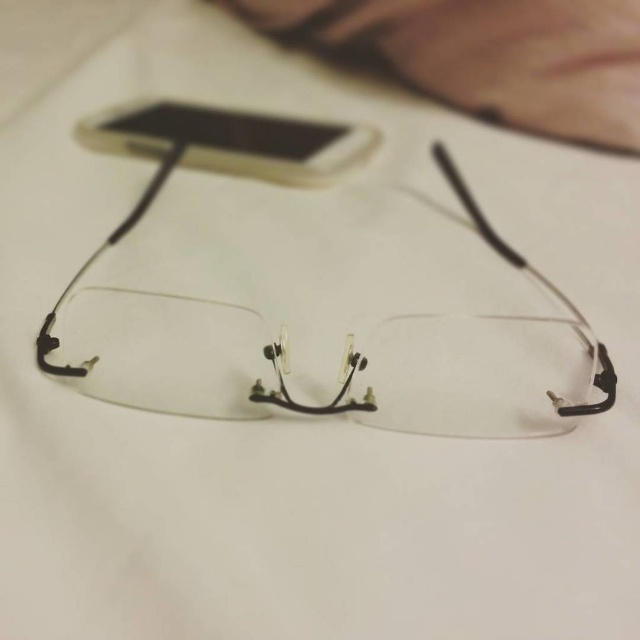
Identify the location of clear plastic glasses at center. (285, 330).

Is clear plastic glasses at center wider than white plastic phone at upper center?

Indeed, clear plastic glasses at center has a greater width compared to white plastic phone at upper center.

What are the coordinates of `clear plastic glasses at center` in the screenshot? It's located at point(285,330).